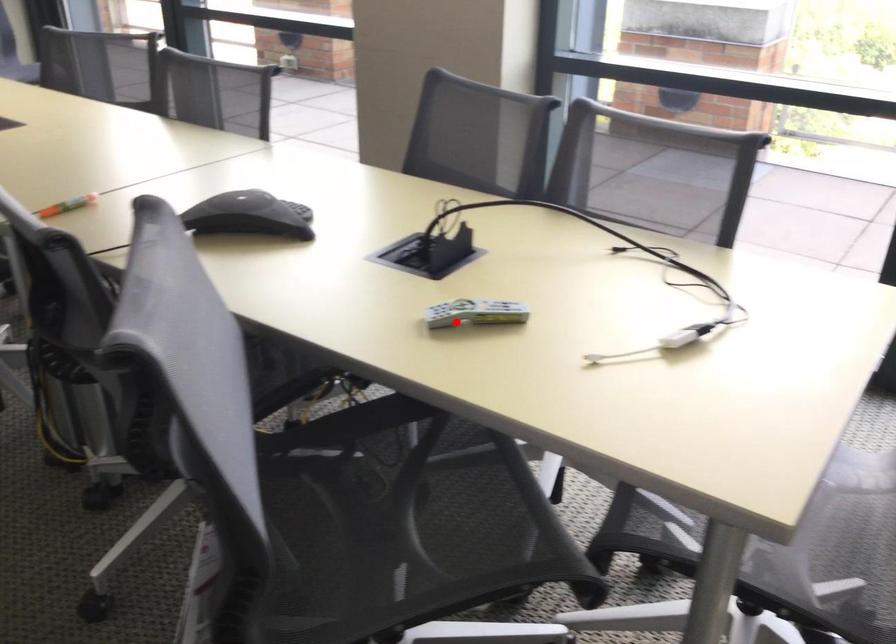
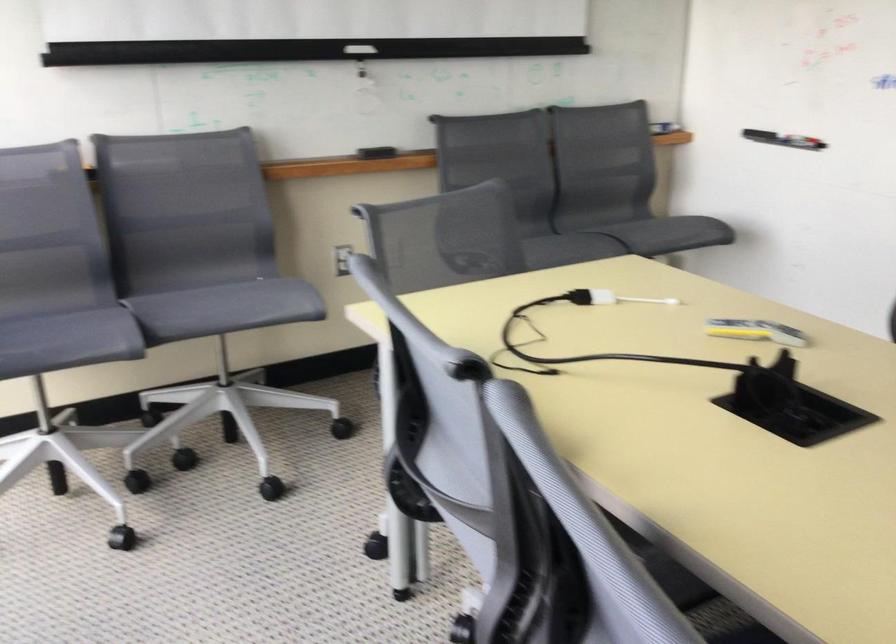
Where in the second image is the point corresponding to the highlighted location from the first image?

(755, 330)